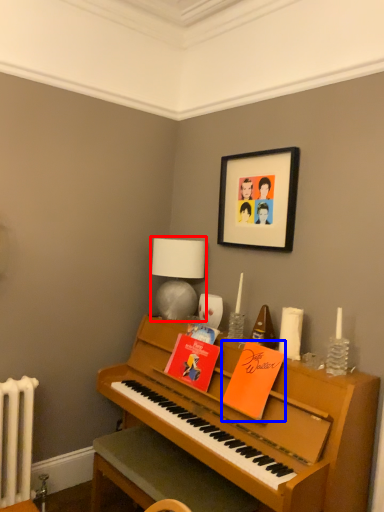
Question: Among these objects, which one is farthest to the camera, table lamp (highlighted by a red box) or book (highlighted by a blue box)?

Choices:
 (A) table lamp
 (B) book

Answer: (A)